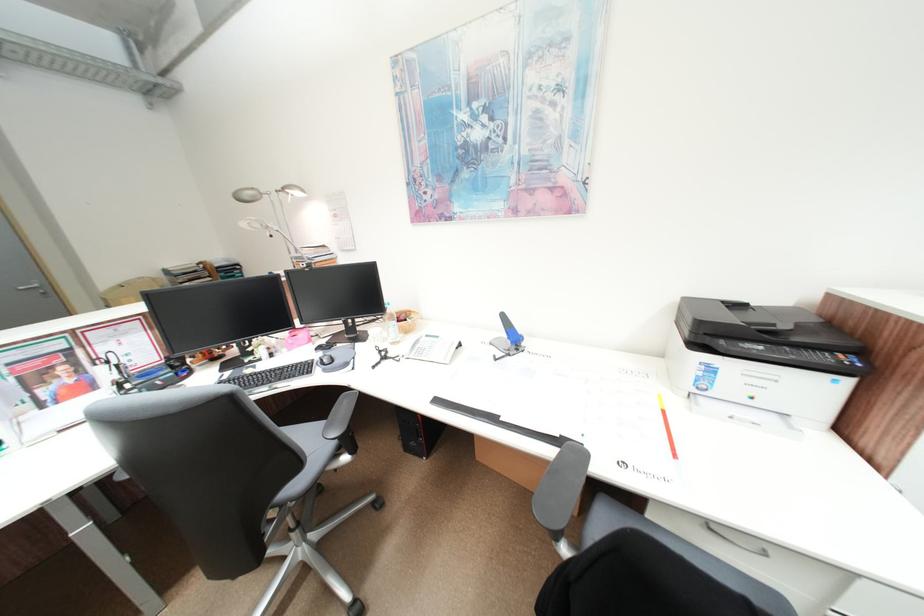
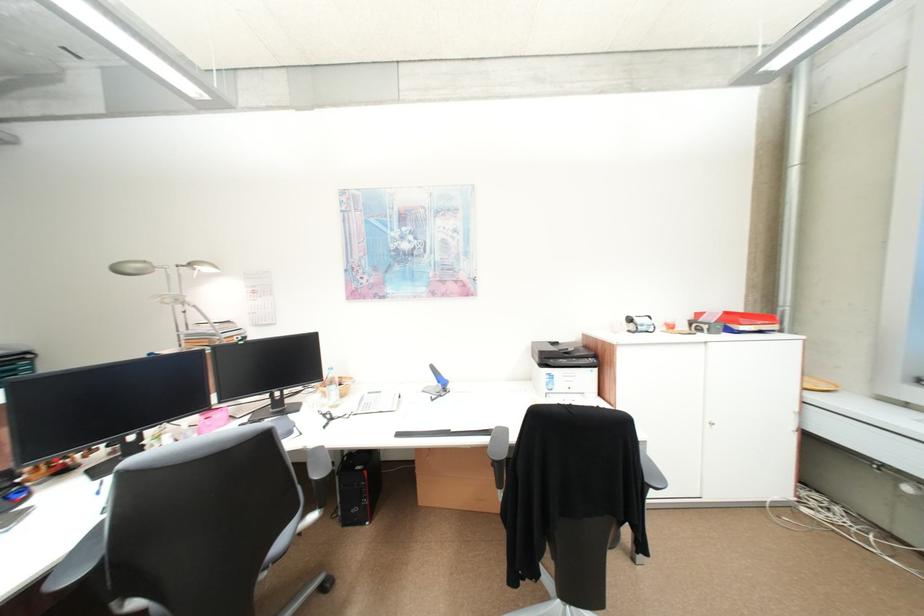
Where in the second image is the point corresponding to point 433,339 from the first image?

(377, 397)